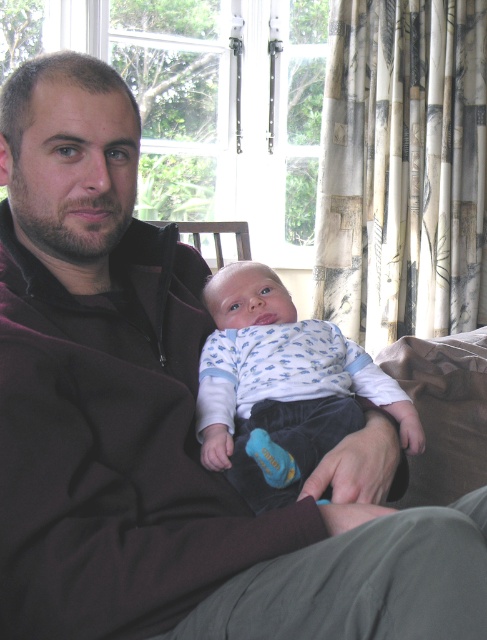
Question: Which object appears farthest from the camera in this image?

Choices:
 (A) wooden armchair at center
 (B) white cotton onesie at center

Answer: (A)

Question: Which of the following is the farthest from the observer?

Choices:
 (A) (333, 324)
 (B) (209, 230)

Answer: (B)

Question: Which point appears farthest from the camera in this image?

Choices:
 (A) (276, 401)
 (B) (249, 248)

Answer: (B)

Question: Does white cotton onesie at center have a greater width compared to wooden armchair at center?

Choices:
 (A) yes
 (B) no

Answer: (A)

Question: Does white cotton onesie at center lie behind wooden armchair at center?

Choices:
 (A) no
 (B) yes

Answer: (A)

Question: Is white cotton onesie at center closer to the viewer compared to wooden armchair at center?

Choices:
 (A) yes
 (B) no

Answer: (A)